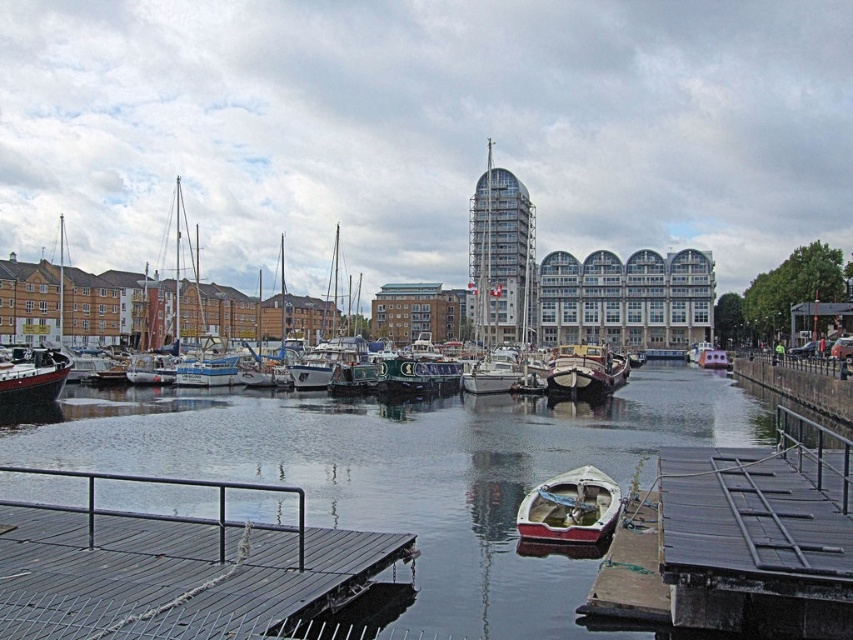
Is point (317, 401) in front of point (85, 602)?

No.

Based on the photo, who is higher up, smooth dark water at center or dark gray wooden dock at lower left?

dark gray wooden dock at lower left is above.

Locate an element on the screen. This screenshot has width=853, height=640. smooth dark water at center is located at coordinates (416, 472).

Who is positioned more to the left, white wooden boat at center or wooden polished boat at center?

Positioned to the left is white wooden boat at center.

Is point (589, 468) positioned before point (570, 380)?

Yes.

Is point (535, 518) positioned after point (624, 356)?

No.

This screenshot has height=640, width=853. In order to click on white wooden boat at center in this screenshot , I will do `click(570, 508)`.

Measure the distance between white wooden boat at center and matte black boat at left.

They are 167.21 feet apart.

Can you confirm if white wooden boat at center is wider than matte black boat at left?

No.

This screenshot has height=640, width=853. Find the location of `white wooden boat at center`. white wooden boat at center is located at coordinates (570, 508).